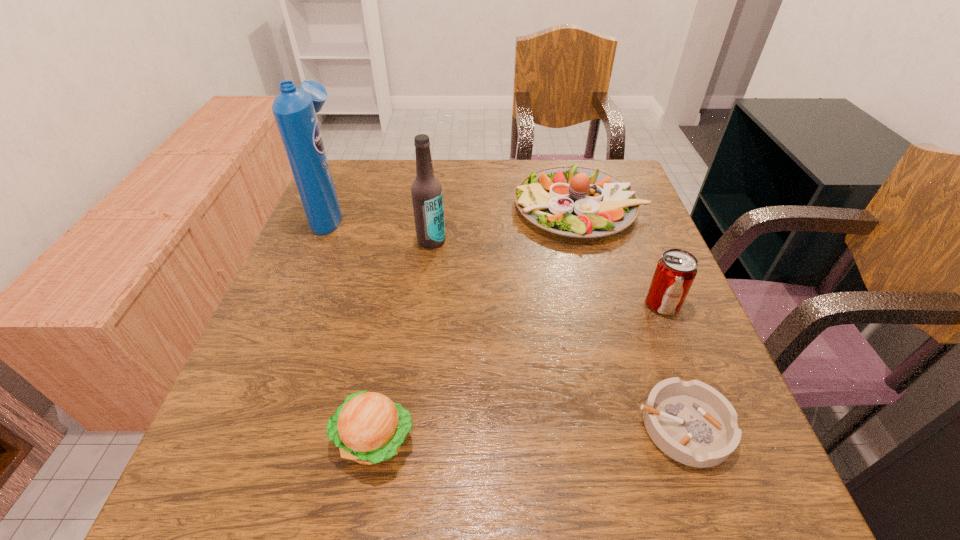
Identify the location of empty space that is in between the ashtray and the shampoo. Image resolution: width=960 pixels, height=540 pixels. (507, 319).

You are a GUI agent. You are given a task and a screenshot of the screen. Output one action in this format:
    pyautogui.click(x=<x>, y=<y>)
    Task: Click on the free space between the salad plate and the hamburger
    This screenshot has width=960, height=540.
    Given the screenshot: What is the action you would take?
    pyautogui.click(x=477, y=323)

I want to click on free point between the beer bottle and the pop soda, so click(547, 272).

The width and height of the screenshot is (960, 540). I want to click on free space that is in between the hamburger and the shampoo, so click(352, 326).

I want to click on free space between the pop soda and the hamburger, so click(518, 372).

At what (x,y) coordinates should I click in order to perform the action: click on empty space that is in between the hamburger and the shortest object. Please return your answer as a coordinate pair (x, y). The image size is (960, 540). Looking at the image, I should click on (529, 433).

Where is `vacant space in between the second tallest object and the fourth farthest object`? vacant space in between the second tallest object and the fourth farthest object is located at coordinates (547, 272).

Locate an element on the screen. free spot between the fourth shortest object and the salad plate is located at coordinates (621, 255).

Locate an element on the screen. This screenshot has width=960, height=540. free space between the tallest object and the beer bottle is located at coordinates (381, 226).

I want to click on empty space that is in between the hamburger and the shampoo, so click(x=352, y=326).